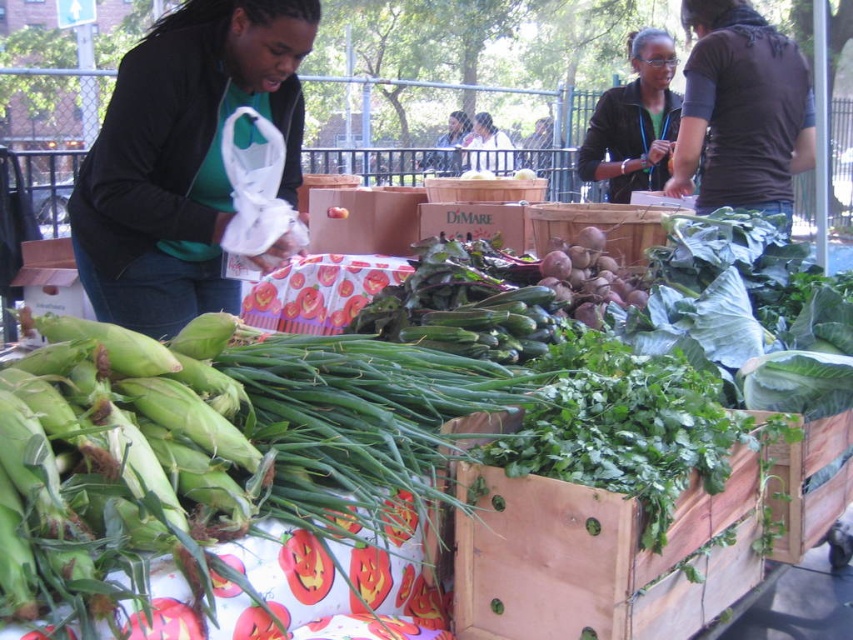
You are standing in the market and want to pick up the matte green shirt at center and the green fabric shirt at upper center. How far apart are these two shirts?

The matte green shirt at center and the green fabric shirt at upper center are 3.45 feet apart.

You are a customer at the farmer market and you see two green shirts displayed on a rack. The first is the matte green shirt at center and the second is the green fabric shirt at upper center. Which one is positioned lower on the rack?

The matte green shirt at center is located below the green fabric shirt at upper center, so it is positioned lower on the rack.

You are standing at the center of the farmer market. You see a dark brown shirt at upper right. Where is the point at coordinate (741, 109) located?

The point at coordinate (741, 109) is located on the dark brown shirt at upper right.